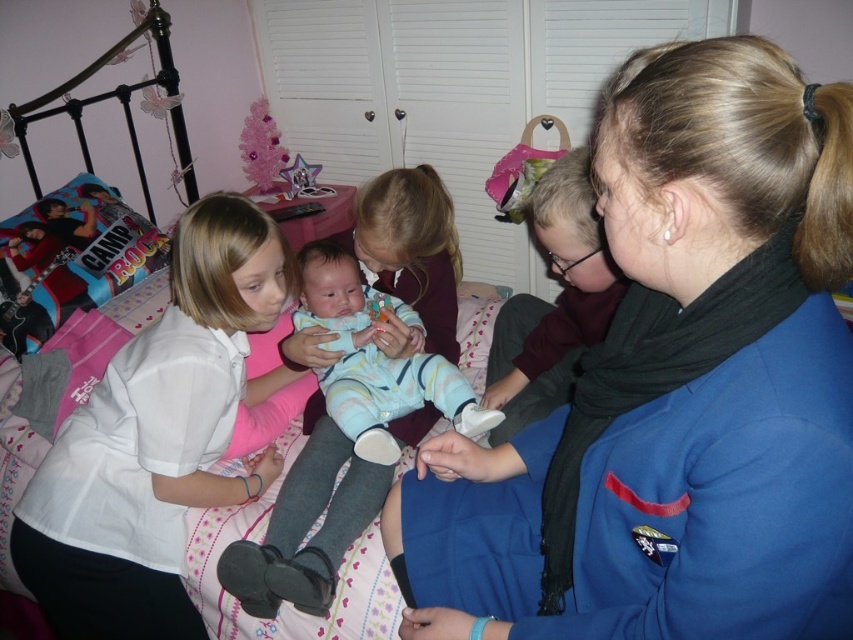
Is blue uniform at center shorter than light blue striped onesie at center?

No.

Does point (722, 330) come behind point (367, 326)?

That is False.

Locate an element on the screen. The width and height of the screenshot is (853, 640). blue uniform at center is located at coordinates (674, 388).

Measure the distance between blue uniform at center and camera.

They are 21.63 inches apart.

The width and height of the screenshot is (853, 640). What do you see at coordinates (674, 388) in the screenshot? I see `blue uniform at center` at bounding box center [674, 388].

Between point (721, 438) and point (15, 522), which one is positioned behind?

Positioned behind is point (15, 522).

At what (x,y) coordinates should I click in order to perform the action: click on blue uniform at center. Please return your answer as a coordinate pair (x, y). The image size is (853, 640). Looking at the image, I should click on (674, 388).

In the scene shown: Does light blue fabric baby at center have a lesser width compared to light blue striped onesie at center?

Yes.

Is light blue fabric baby at center closer to camera compared to light blue striped onesie at center?

That is True.

Describe the element at coordinates (306, 524) in the screenshot. The height and width of the screenshot is (640, 853). I see `light blue fabric baby at center` at that location.

Find the location of a particular element. light blue fabric baby at center is located at coordinates (306, 524).